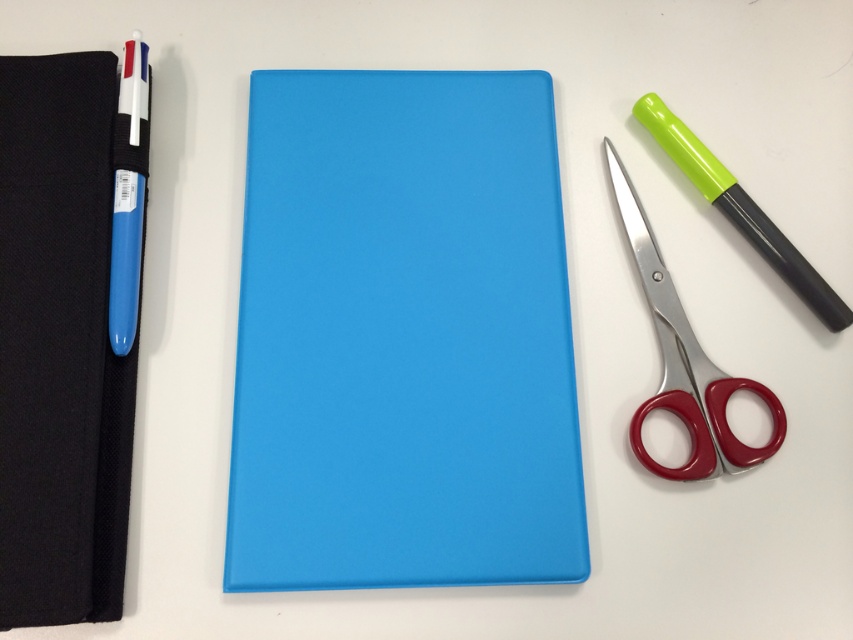
Which is more to the right, black fabric notebook at left or red plastic scissors at right?

From the viewer's perspective, red plastic scissors at right appears more on the right side.

Consider the image. Is the position of black fabric notebook at left more distant than that of red plastic scissors at right?

That is False.

Between point (102, 300) and point (782, 420), which one is positioned in front?

Point (102, 300) is in front.

In order to click on black fabric notebook at left in this screenshot , I will do `click(61, 346)`.

What do you see at coordinates (685, 362) in the screenshot? I see `red plastic scissors at right` at bounding box center [685, 362].

Which is more to the right, red plastic scissors at right or matte plastic pen at left?

red plastic scissors at right

Who is more distant from viewer, (701, 454) or (134, 84)?

Point (134, 84)

The height and width of the screenshot is (640, 853). What are the coordinates of `red plastic scissors at right` in the screenshot? It's located at (685, 362).

Where is `red plastic scissors at right`? The image size is (853, 640). red plastic scissors at right is located at coordinates (685, 362).

From the picture: Is red plastic scissors at right to the left of green matte pen at right from the viewer's perspective?

Indeed, red plastic scissors at right is positioned on the left side of green matte pen at right.

Is point (635, 220) closer to camera compared to point (775, 266)?

No, (635, 220) is further to viewer.

The height and width of the screenshot is (640, 853). Identify the location of red plastic scissors at right. (685, 362).